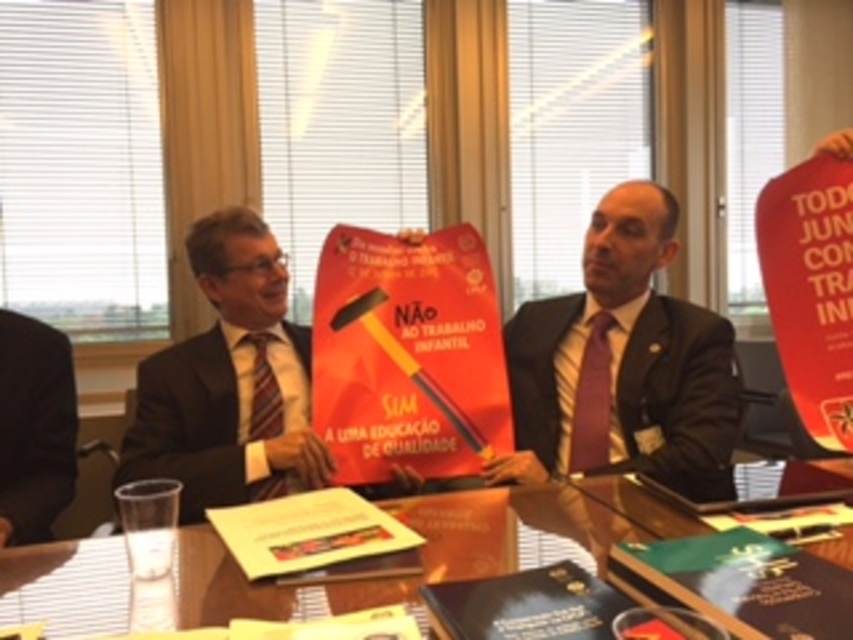
Question: Is matte black suit at center to the right of green matte book at lower right from the viewer's perspective?

Choices:
 (A) no
 (B) yes

Answer: (B)

Question: Considering the real-world distances, which object is farthest from the maroon striped tie at center?

Choices:
 (A) matte red poster at center
 (B) orange textured tie at center
 (C) black matte book at center

Answer: (C)

Question: Does matte red poster at center have a smaller size compared to green matte book at lower right?

Choices:
 (A) no
 (B) yes

Answer: (A)

Question: Does matte black suit at center appear under yellow paper at center?

Choices:
 (A) yes
 (B) no

Answer: (B)

Question: Which point is closer to the camera taking this photo?

Choices:
 (A) (45, 496)
 (B) (321, 364)
 (C) (602, 433)
 (D) (798, 470)

Answer: (D)

Question: Which object is farther from the camera taking this photo?

Choices:
 (A) black suit at left
 (B) black matte book at center
 (C) yellow paper at center

Answer: (A)